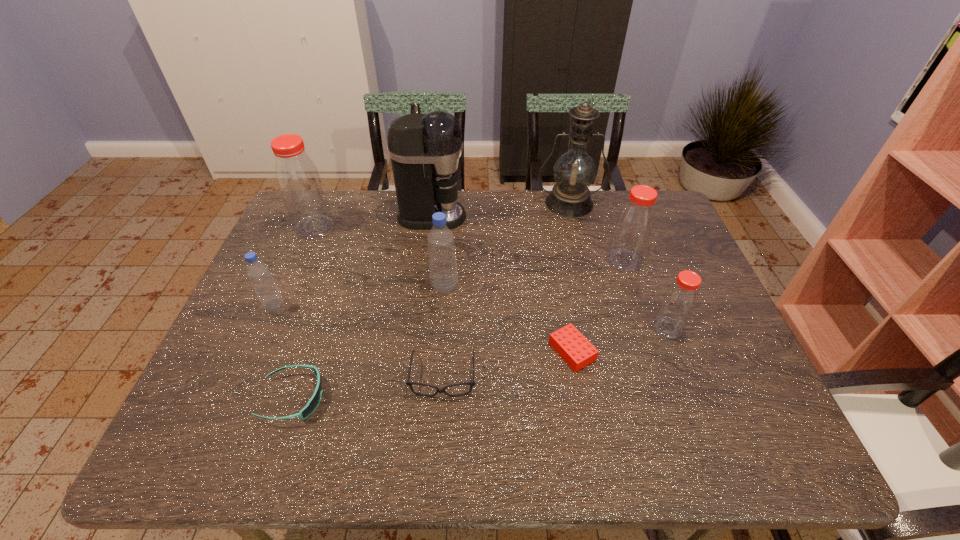
This screenshot has height=540, width=960. In order to click on unoccupied position between the right blue bottle and the spectacles in this screenshot , I will do `click(444, 332)`.

Locate an element on the screen. Image resolution: width=960 pixels, height=540 pixels. unoccupied area between the left blue bottle and the biggest red bottle is located at coordinates (295, 267).

The width and height of the screenshot is (960, 540). I want to click on free space between the oil lamp and the second smallest red bottle, so click(x=596, y=232).

Where is `free space between the fourth farthest object and the third tallest object`? This screenshot has width=960, height=540. free space between the fourth farthest object and the third tallest object is located at coordinates (469, 244).

I want to click on free space between the smallest red bottle and the coffee maker, so click(x=549, y=272).

Image resolution: width=960 pixels, height=540 pixels. Find the location of `vacant space in between the sunglasses and the Lego`. vacant space in between the sunglasses and the Lego is located at coordinates (432, 374).

In order to click on blank region between the seventh nearest object and the coffee maker in this screenshot , I will do `click(528, 239)`.

Locate an element on the screen. object that is the ninth closest one to the nearer blue bottle is located at coordinates (679, 301).

Locate an element on the screen. the second closest object to the biggest red bottle is located at coordinates (258, 272).

Select which bottle is the fifth closest to the sunglasses. Please provide its 2D coordinates. Your answer should be formatted as a tuple, i.e. [(x, y)], where the tuple contains the x and y coordinates of a point satisfying the conditions above.

[(634, 224)]